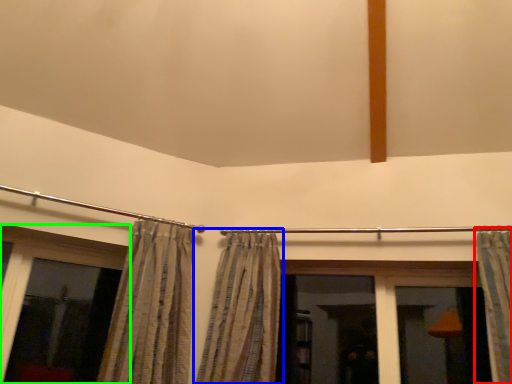
Question: Considering the real-world distances, which object is closest to curtain (highlighted by a red box)? curtain (highlighted by a blue box) or window (highlighted by a green box).

Choices:
 (A) curtain
 (B) window

Answer: (A)